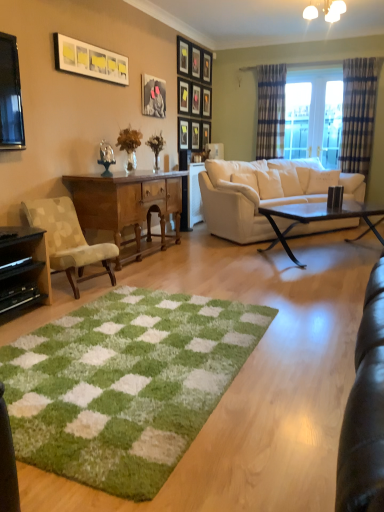
In order to click on plaid fabric curtain at right, which is the second curtain in left-to-right order in this screenshot , I will do `click(359, 111)`.

The height and width of the screenshot is (512, 384). Describe the element at coordinates (207, 67) in the screenshot. I see `matte black picture frame at upper center, which is the third picture frame in back-to-front order` at that location.

How much space does wooden picture frame at upper center, the first picture frame positioned from the back, occupy vertically?

wooden picture frame at upper center, the first picture frame positioned from the back, is 44.69 centimeters in height.

The image size is (384, 512). Describe the element at coordinates (206, 134) in the screenshot. I see `wooden picture frame at upper center, which appears as the 11th picture frame when viewed from the front` at that location.

This screenshot has width=384, height=512. What are the coordinates of `plaid fabric curtain at right, the first curtain in the right-to-left sequence` in the screenshot? It's located at (359, 111).

Is point (211, 57) positioned in front of point (157, 90)?

No.

From the image's perspective, does matte black picture frame at upper center, the 9th picture frame when ordered from front to back, appear higher than matte black picture frame at upper center, the 10th picture frame when ordered from back to front?

Yes, from the image's perspective, matte black picture frame at upper center, the 9th picture frame when ordered from front to back, is over matte black picture frame at upper center, the 10th picture frame when ordered from back to front.

Does matte black picture frame at upper center, the 9th picture frame when ordered from front to back, have a greater width compared to matte black picture frame at upper center, the 10th picture frame when ordered from back to front?

Yes.

Who is smaller, matte black picture frame at upper center, the 9th picture frame when ordered from front to back, or matte black picture frame at upper center, which is the second picture frame in front-to-back order?

matte black picture frame at upper center, which is the second picture frame in front-to-back order, is smaller.

Is green shaggy rug at center looking in the opposite direction of plaid fabric curtain at right, which is the second curtain in left-to-right order?

green shaggy rug at center does not have its back to plaid fabric curtain at right, which is the second curtain in left-to-right order.

At what (x,y) coordinates should I click in order to perform the action: click on the 1st curtain located above the green shaggy rug at center (from a real-world perspective). Please return your answer as a coordinate pair (x, y). Looking at the image, I should click on (359, 111).

Consider the image. Is green shaggy rug at center thinner than plaid fabric curtain at right, which is the second curtain in left-to-right order?

Incorrect, the width of green shaggy rug at center is not less than that of plaid fabric curtain at right, which is the second curtain in left-to-right order.

Would you consider green shaggy rug at center to be distant from plaid fabric curtain at right, the first curtain in the right-to-left sequence?

That's right, there is a large distance between green shaggy rug at center and plaid fabric curtain at right, the first curtain in the right-to-left sequence.

Is white frosted glass chandelier at upper center further to the viewer compared to black matte entertainment center at lower left?

Yes, white frosted glass chandelier at upper center is further from the viewer.

In the scene shown: Does white frosted glass chandelier at upper center have a larger size compared to black matte entertainment center at lower left?

No, white frosted glass chandelier at upper center is not bigger than black matte entertainment center at lower left.

From their relative heights in the image, would you say white frosted glass chandelier at upper center is taller or shorter than black matte entertainment center at lower left?

Clearly, white frosted glass chandelier at upper center is shorter compared to black matte entertainment center at lower left.

Considering the relative positions of white frosted glass chandelier at upper center and black matte entertainment center at lower left in the image provided, is white frosted glass chandelier at upper center to the left of black matte entertainment center at lower left from the viewer's perspective?

No, white frosted glass chandelier at upper center is not to the left of black matte entertainment center at lower left.

How many degrees apart are the facing directions of translucent glass vase at center, which is the first houseplant from back to front, and matte black picture frame at upper center, which is the eighth picture frame from back to front?

1.77 degrees.

In terms of height, does translucent glass vase at center, the second houseplant positioned from the left, look taller or shorter compared to matte black picture frame at upper center, which is the eighth picture frame from back to front?

Considering their sizes, translucent glass vase at center, the second houseplant positioned from the left, has less height than matte black picture frame at upper center, which is the eighth picture frame from back to front.

Is translucent glass vase at center, acting as the second houseplant starting from the front, not near matte black picture frame at upper center, acting as the 4th picture frame starting from the front?

They are positioned close to each other.

Is translucent glass vase at center, which is the first houseplant from back to front, at the left side of matte black picture frame at upper center, acting as the 4th picture frame starting from the front?

Yes.

From the image's perspective, which one is positioned lower, wooden picture frame at center, positioned as the fourth picture frame in back-to-front order, or black matte entertainment center at lower left?

black matte entertainment center at lower left is shown below in the image.

What's the angular difference between wooden picture frame at center, positioned as the fourth picture frame in back-to-front order, and black matte entertainment center at lower left's facing directions?

3.37 degrees.

From the image's perspective, starting from the black matte entertainment center at lower left, which picture frame is the 2nd one above? Please provide its 2D coordinates.

[(195, 136)]

Looking at the image, does wooden picture frame at center, positioned as the fourth picture frame in back-to-front order, seem bigger or smaller compared to black matte entertainment center at lower left?

Considering their sizes, wooden picture frame at center, positioned as the fourth picture frame in back-to-front order, takes up less space than black matte entertainment center at lower left.

How far apart are matte black picture frame at upper center, which is the second picture frame in front-to-back order, and plaid fabric curtain at right, the first curtain positioned from the left?

The distance of matte black picture frame at upper center, which is the second picture frame in front-to-back order, from plaid fabric curtain at right, the first curtain positioned from the left, is 8.19 feet.

Image resolution: width=384 pixels, height=512 pixels. Identify the location of picture frame that is the 1st object above the plaid fabric curtain at right, the 2th curtain when ordered from right to left (from a real-world perspective). (153, 96).

Considering the positions of points (154, 97) and (273, 95), is point (154, 97) closer to camera compared to point (273, 95)?

Yes.

Consider the image. From the image's perspective, is matte black picture frame at upper center, the 10th picture frame when ordered from back to front, above plaid fabric curtain at right, the 2th curtain when ordered from right to left?

Actually, matte black picture frame at upper center, the 10th picture frame when ordered from back to front, appears below plaid fabric curtain at right, the 2th curtain when ordered from right to left, in the image.

Considering the sizes of objects green shaggy rug at center and matte black picture frame at upper center, which is the eighth picture frame from back to front, in the image provided, who is shorter, green shaggy rug at center or matte black picture frame at upper center, which is the eighth picture frame from back to front,?

green shaggy rug at center is shorter.

From the green shaggy rug at center, count 2nd picture frame to the right and point to it. Please provide its 2D coordinates.

[(184, 96)]

What's the angular difference between green shaggy rug at center and matte black picture frame at upper center, acting as the 4th picture frame starting from the front,'s facing directions?

91.5 degrees.

Is green shaggy rug at center positioned beyond the bounds of matte black picture frame at upper center, acting as the 4th picture frame starting from the front?

Absolutely, green shaggy rug at center is external to matte black picture frame at upper center, acting as the 4th picture frame starting from the front.

Find the location of a particular element. This screenshot has width=384, height=512. the 6th picture frame positioned above the matte black picture frame at upper center, the 10th picture frame when ordered from back to front (from a real-world perspective) is located at coordinates (207, 67).

Find the location of a particular element. This screenshot has width=384, height=512. mat in front of the plaid fabric curtain at right, which is the second curtain in left-to-right order is located at coordinates (125, 384).

From the image, which object appears to be nearer to translucent glass vase at center, acting as the 1th houseplant starting from the front, matte black picture frame at upper center, which is the third picture frame in back-to-front order, or white leather couch at center?

white leather couch at center lies closer to translucent glass vase at center, acting as the 1th houseplant starting from the front, than the other object.

Estimate the real-world distances between objects in this image. Which object is closer to plaid fabric curtain at right, the first curtain in the right-to-left sequence, black matte entertainment center at lower left or wooden picture frame at upper center, marked as the third picture frame in a front-to-back arrangement?

Among the two, wooden picture frame at upper center, marked as the third picture frame in a front-to-back arrangement, is located nearer to plaid fabric curtain at right, the first curtain in the right-to-left sequence.

Which object lies further to the anchor point black glass coffee table at center, translucent glass vase at center, the second houseplant positioned from the left, or matte black picture frame at upper center, which is counted as the fifth picture frame, starting from the back?

matte black picture frame at upper center, which is counted as the fifth picture frame, starting from the back, is positioned further to the anchor black glass coffee table at center.

Estimate the real-world distances between objects in this image. Which object is closer to wooden picture frame at upper center, arranged as the 2th picture frame when viewed from the back, matte black picture frame at upper center, the fifth picture frame viewed from the front, or wooden picture frame at upper center, which appears as the 11th picture frame when viewed from the front?

Among the two, wooden picture frame at upper center, which appears as the 11th picture frame when viewed from the front, is located nearer to wooden picture frame at upper center, arranged as the 2th picture frame when viewed from the back.

Which object lies nearer to the anchor point translucent glass vase at center, the second houseplant positioned from the left, matte black picture frame at upper center, which is the eighth picture frame from back to front, or translucent glass vase at center, which is counted as the 2th houseplant, starting from the right?

Based on the image, translucent glass vase at center, which is counted as the 2th houseplant, starting from the right, appears to be nearer to translucent glass vase at center, the second houseplant positioned from the left.

When comparing their distances from white frosted glass chandelier at upper center, does wooden polished desk at left or wooden picture frame at center, positioned as the fourth picture frame in back-to-front order, seem further?

Based on the image, wooden polished desk at left appears to be further to white frosted glass chandelier at upper center.

Considering their positions, is matte black picture frame at upper center, the 9th picture frame when ordered from front to back, positioned closer to beige fabric chair at left than wooden picture frame at upper center, arranged as the ninth picture frame when viewed from the back?

Among the two, wooden picture frame at upper center, arranged as the ninth picture frame when viewed from the back, is located nearer to beige fabric chair at left.

Considering their positions, is translucent glass vase at center, acting as the second houseplant starting from the front, positioned closer to green shaggy rug at center than matte black picture frame at upper center, which is the sixth picture frame from back to front?

translucent glass vase at center, acting as the second houseplant starting from the front, is positioned closer to the anchor green shaggy rug at center.

The width and height of the screenshot is (384, 512). Identify the location of desk between green shaggy rug at center and translucent glass vase at center, the second houseplant positioned from the left, along the z-axis. (127, 204).

Locate an element on the screen. studio couch between matte black picture frame at upper center, which is the second picture frame in front-to-back order, and plaid fabric curtain at right, the first curtain in the right-to-left sequence is located at coordinates (264, 193).

Image resolution: width=384 pixels, height=512 pixels. What are the coordinates of `desk between white glossy picture frame at upper left, which is the eleventh picture frame from back to front, and wooden picture frame at upper center, which appears as the 11th picture frame when viewed from the front, along the z-axis` in the screenshot? It's located at (127, 204).

At what (x,y) coordinates should I click in order to perform the action: click on desk between green shaggy rug at center and matte black picture frame at upper center, the 10th picture frame when ordered from back to front, from front to back. Please return your answer as a coordinate pair (x, y). The height and width of the screenshot is (512, 384). Looking at the image, I should click on (127, 204).